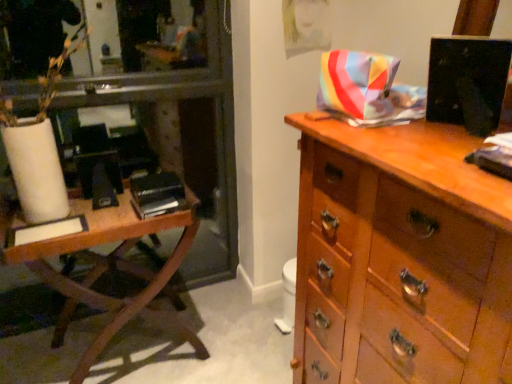
Question: Does black matte book at left appear on the right side of wooden table at left?

Choices:
 (A) yes
 (B) no

Answer: (A)

Question: From a real-world perspective, does black matte book at left sit lower than wooden table at left?

Choices:
 (A) yes
 (B) no

Answer: (B)

Question: Is black matte book at left next to wooden table at left?

Choices:
 (A) yes
 (B) no

Answer: (B)

Question: Is black matte book at left far from wooden table at left?

Choices:
 (A) no
 (B) yes

Answer: (A)

Question: From the image's perspective, is black matte book at left above wooden table at left?

Choices:
 (A) no
 (B) yes

Answer: (B)

Question: In terms of size, does white matte vase at left appear bigger or smaller than wooden chest of drawers at right?

Choices:
 (A) big
 (B) small

Answer: (B)

Question: In the image, is white matte vase at left on the left side or the right side of wooden chest of drawers at right?

Choices:
 (A) left
 (B) right

Answer: (A)

Question: Is white matte vase at left spatially inside wooden chest of drawers at right, or outside of it?

Choices:
 (A) inside
 (B) outside

Answer: (B)

Question: From the image's perspective, is white matte vase at left located above or below wooden chest of drawers at right?

Choices:
 (A) above
 (B) below

Answer: (A)

Question: Is point (395, 347) positioned closer to the camera than point (134, 178)?

Choices:
 (A) closer
 (B) farther

Answer: (A)

Question: Do you think wooden chest of drawers at right is within black matte book at left, or outside of it?

Choices:
 (A) outside
 (B) inside

Answer: (A)

Question: Is wooden chest of drawers at right wider or thinner than black matte book at left?

Choices:
 (A) thin
 (B) wide

Answer: (B)

Question: Relative to black matte book at left, is wooden chest of drawers at right in front or behind?

Choices:
 (A) behind
 (B) front

Answer: (B)

Question: From the image's perspective, is white matte vase at left above or below black matte book at left?

Choices:
 (A) above
 (B) below

Answer: (A)

Question: Is point (38, 215) closer or farther from the camera than point (146, 178)?

Choices:
 (A) closer
 (B) farther

Answer: (A)